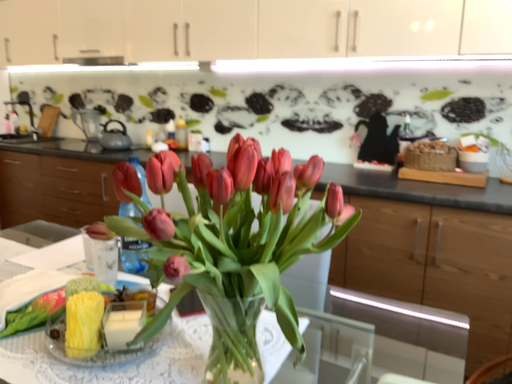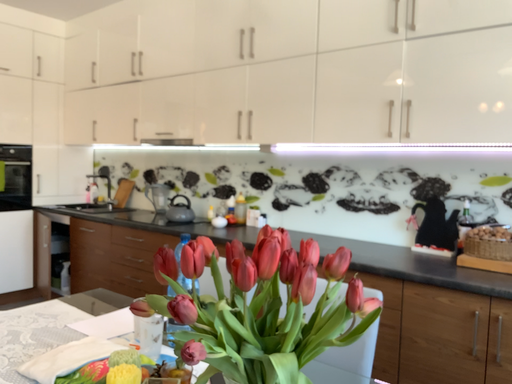
Question: How did the camera likely rotate when shooting the video?

Choices:
 (A) rotated left
 (B) rotated right

Answer: (A)